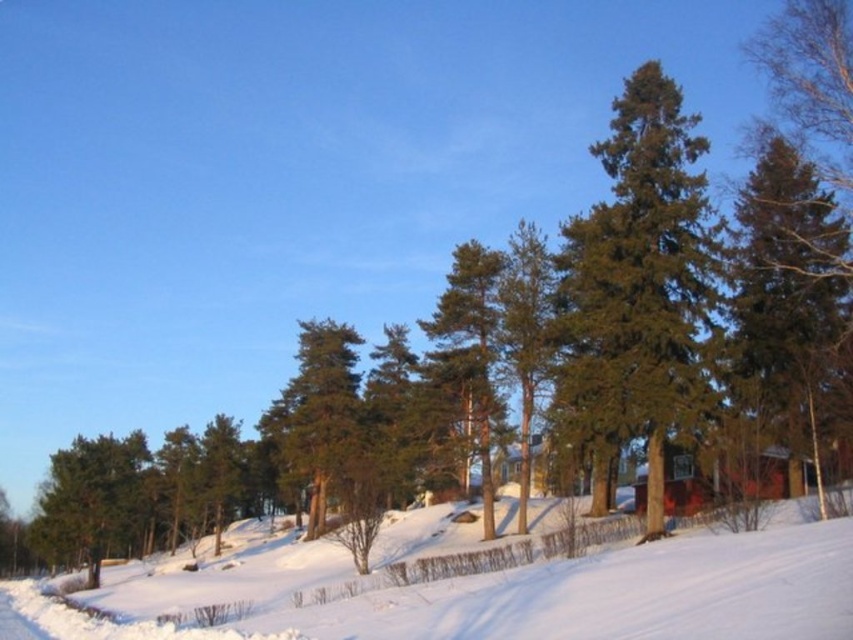
Question: Is the position of green needle-like at center less distant than that of green needle-like tree at center?

Choices:
 (A) yes
 (B) no

Answer: (A)

Question: Among these points, which one is farthest from the camera?

Choices:
 (A) (440, 604)
 (B) (538, 307)

Answer: (B)

Question: Does green needle-like tree at right appear on the left side of green textured pine tree at center?

Choices:
 (A) no
 (B) yes

Answer: (A)

Question: Can you confirm if white snow ski slope at lower left is positioned above green matte tree at center?

Choices:
 (A) yes
 (B) no

Answer: (A)

Question: Among these points, which one is nearest to the camera?

Choices:
 (A) click(468, 310)
 (B) click(746, 260)
 (C) click(306, 410)

Answer: (B)

Question: Which object is farther from the camera taking this photo?

Choices:
 (A) green textured pine tree at center
 (B) white snow ski slope at lower left

Answer: (A)